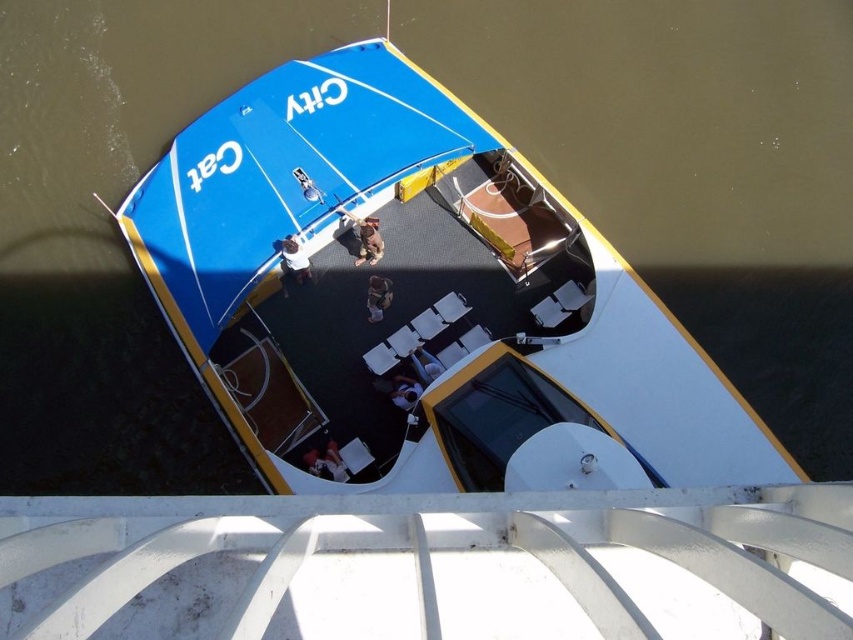
You are a passenger on the boat named City Cat and you dropped your bag. You want to retrieve it. Where is the brown fabric bag at center located on the boat?

The brown fabric bag at center is located at point (364, 236) on the boat.

You are a passenger on the boat and need to find a place to sit. You see the white plastic chairs at center and the white fabric bag at center. Which object is located to the right of the other?

The white plastic chairs at center is positioned on the right side of white fabric bag at center.